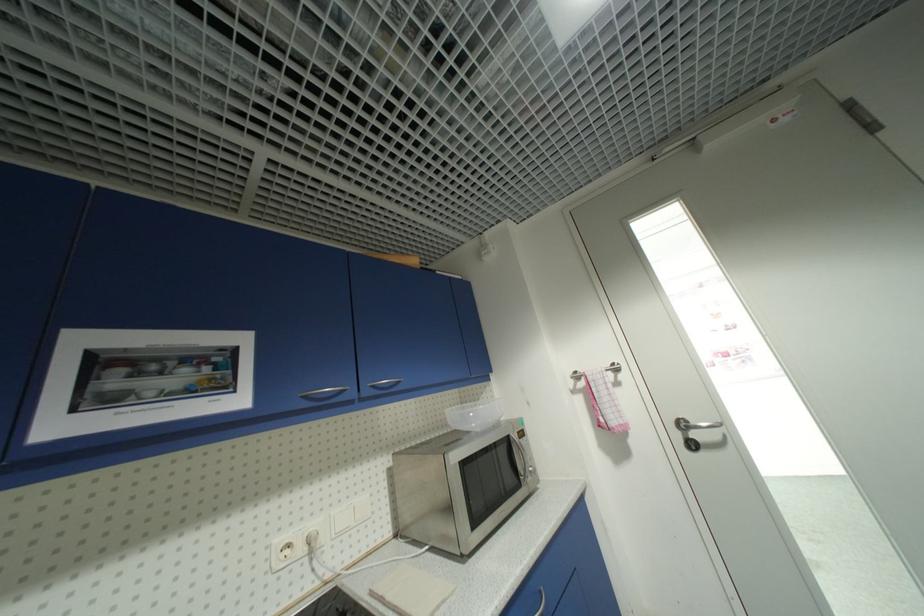
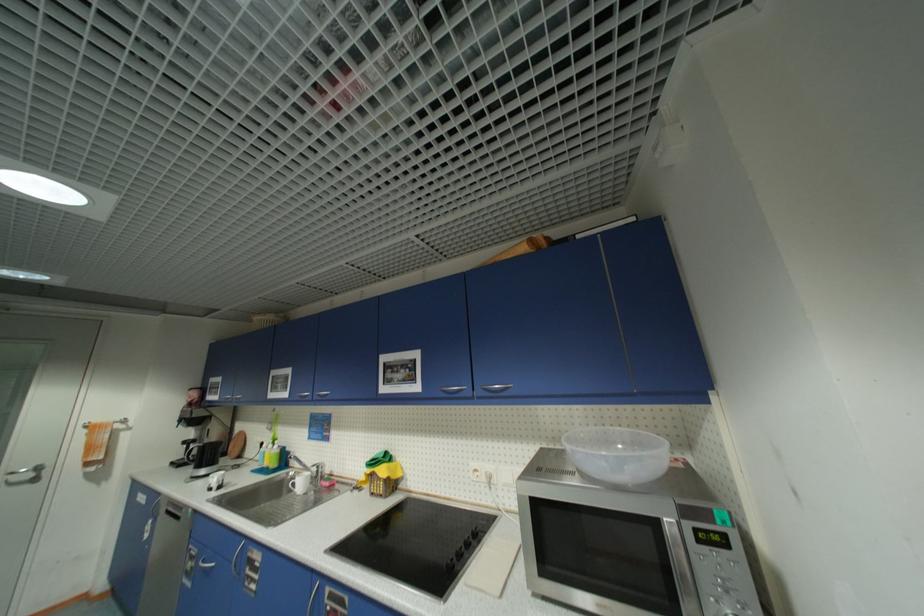
Question: I am providing you with two images of the same scene from different viewpoints. After the viewpoint changes to image2, which objects are now occluded?

Choices:
 (A) sink faucet handle
 (B) silver door handle
 (C) clear plastic bowl
 (D) none of these

Answer: (D)